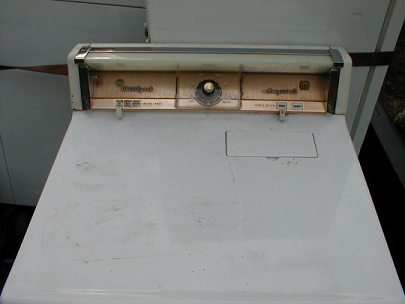
What are the coordinates of `knob` in the screenshot? It's located at (207, 86).